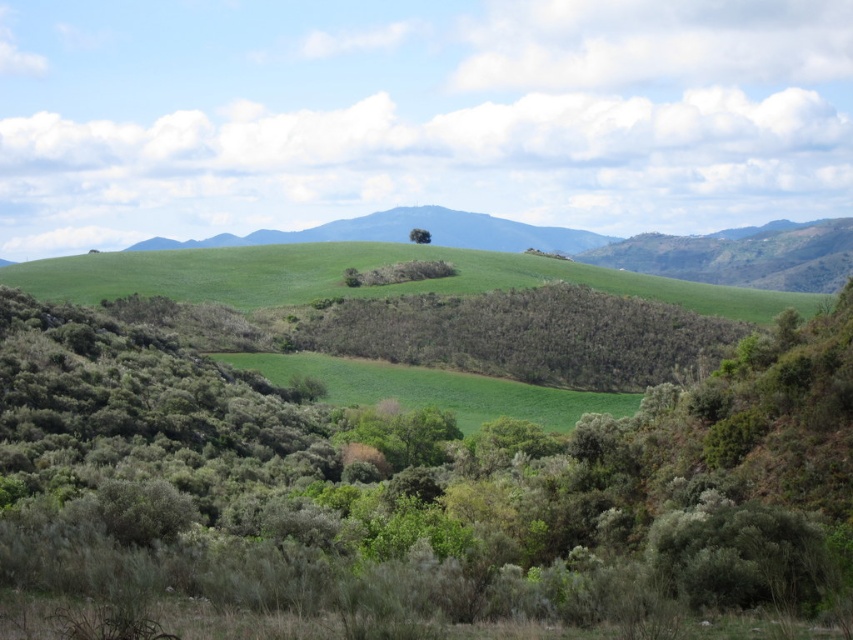
You are standing at the point marked by point (415,490) and want to walk towards the green leafy shrub at center. Which direction should you move?

The green leafy shrub at center is located at point (415,490), so you are already at the shrub.

You are a farmer checking the field from a distance. You see the green grassy field at center and the green leafy tree at center. Which one covers a larger area in the scene?

The green grassy field at center might be wider than green leafy tree at center according to the description.

You are standing at the point marked by the coordinates point (434, 388), which is on the green grassy field at center. If you walk straight ahead, will you eventually reach the rolling hills in the background?

Yes, walking straight ahead from point (434, 388) on the green grassy field at center will lead you towards the rolling hills in the background as they are the prominent features in the distance.